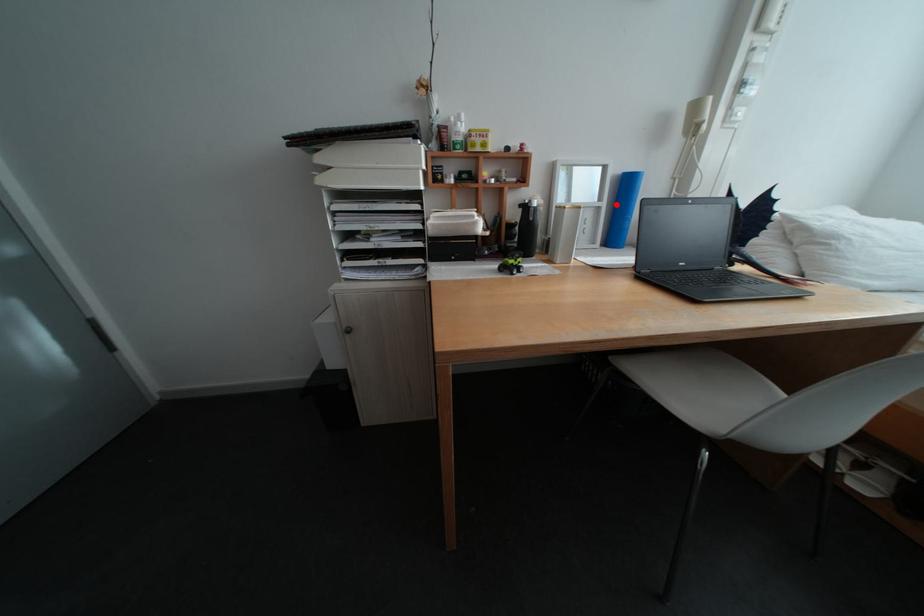
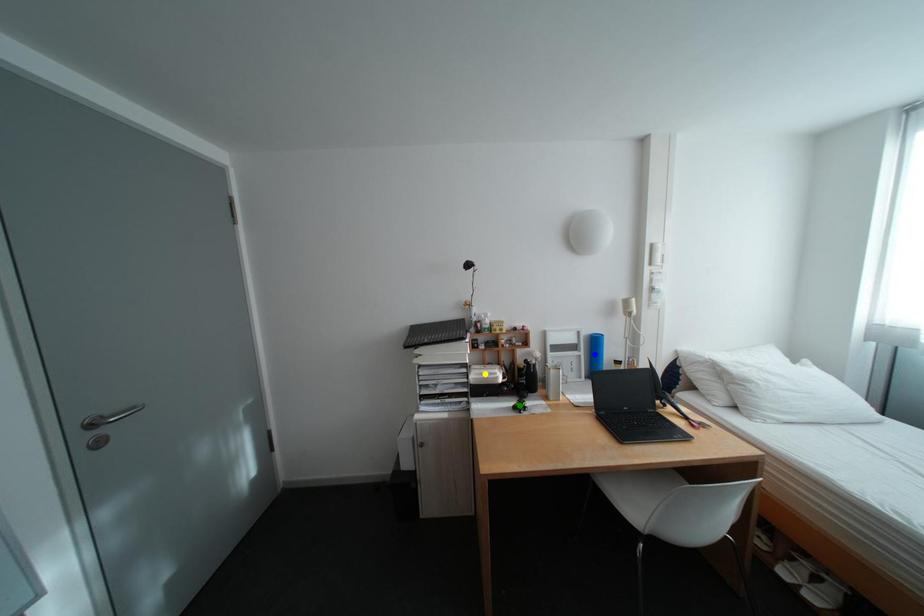
Question: I am providing you with two images of the same scene from different viewpoints. A red point is marked on the first image. You are given multiple points on the second image. Which spot in image 2 lines up with the point in image 1?

Choices:
 (A) green point
 (B) yellow point
 (C) blue point

Answer: (C)